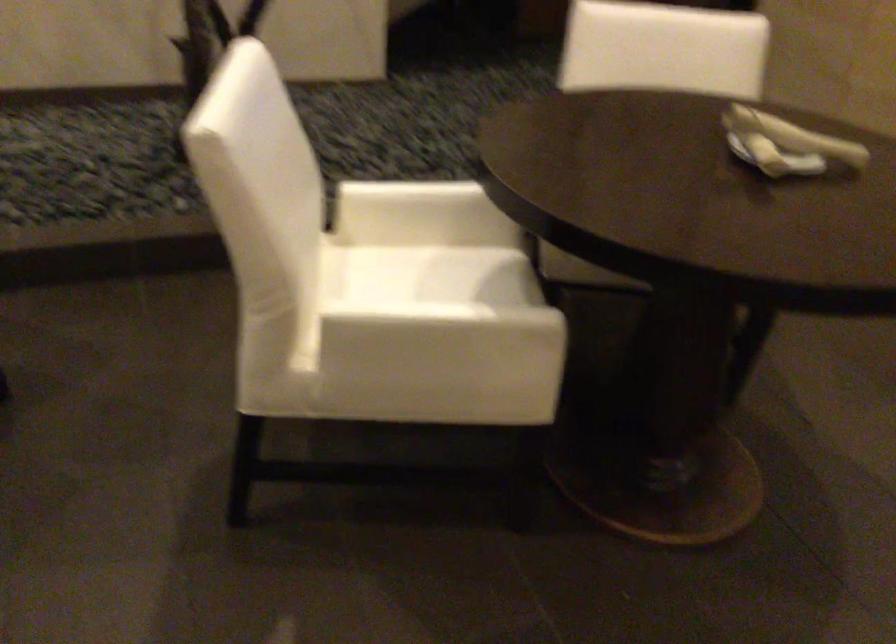
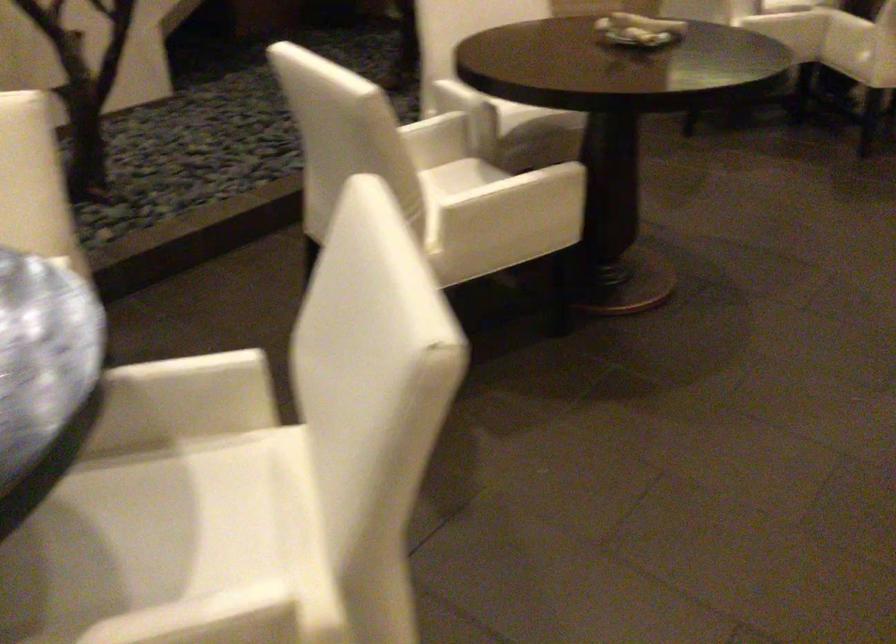
In the second image, find the point that corresponds to point 460,269 in the first image.

(455, 176)